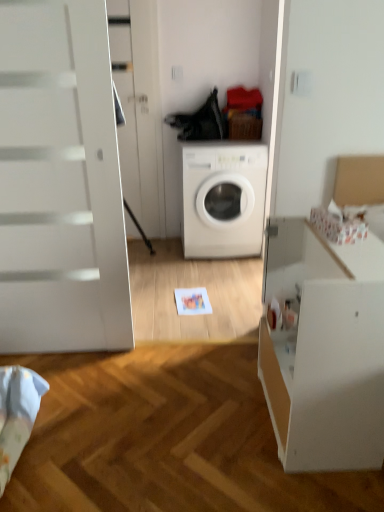
Question: From a real-world perspective, is white glossy screen door at upper left located beneath white matte file cabinet at right?

Choices:
 (A) yes
 (B) no

Answer: (B)

Question: Does white glossy screen door at upper left have a lesser height compared to white matte file cabinet at right?

Choices:
 (A) no
 (B) yes

Answer: (A)

Question: Is white matte file cabinet at right at the back of white glossy screen door at upper left?

Choices:
 (A) yes
 (B) no

Answer: (B)

Question: From the image's perspective, is white glossy screen door at upper left under white matte file cabinet at right?

Choices:
 (A) no
 (B) yes

Answer: (A)

Question: Does white glossy screen door at upper left appear on the left side of white matte file cabinet at right?

Choices:
 (A) yes
 (B) no

Answer: (A)

Question: Relative to white matte washing machine at center, is white matte file cabinet at right in front or behind?

Choices:
 (A) behind
 (B) front

Answer: (B)

Question: From the image's perspective, is white matte file cabinet at right above or below white matte washing machine at center?

Choices:
 (A) below
 (B) above

Answer: (A)

Question: Considering the positions of white matte file cabinet at right and white matte washing machine at center in the image, is white matte file cabinet at right taller or shorter than white matte washing machine at center?

Choices:
 (A) tall
 (B) short

Answer: (B)

Question: From a real-world perspective, relative to white matte washing machine at center, is white matte file cabinet at right vertically above or below?

Choices:
 (A) above
 (B) below

Answer: (B)

Question: Would you say white glossy screen door at upper left is to the left or to the right of white matte file cabinet at right in the picture?

Choices:
 (A) left
 (B) right

Answer: (A)

Question: Considering the positions of white glossy screen door at upper left and white matte file cabinet at right in the image, is white glossy screen door at upper left taller or shorter than white matte file cabinet at right?

Choices:
 (A) short
 (B) tall

Answer: (B)

Question: Is white glossy screen door at upper left wider or thinner than white matte file cabinet at right?

Choices:
 (A) thin
 (B) wide

Answer: (A)

Question: From a real-world perspective, is white glossy screen door at upper left physically located above or below white matte file cabinet at right?

Choices:
 (A) below
 (B) above

Answer: (B)

Question: Looking at the image, does white matte washing machine at center seem bigger or smaller compared to white glossy screen door at upper left?

Choices:
 (A) small
 (B) big

Answer: (B)

Question: From the image's perspective, relative to white glossy screen door at upper left, is white matte washing machine at center above or below?

Choices:
 (A) below
 (B) above

Answer: (A)